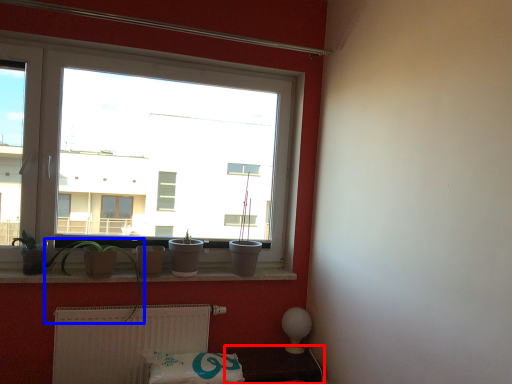
Question: Which of the following is the farthest to the observer, furniture (highlighted by a red box) or plant (highlighted by a blue box)?

Choices:
 (A) furniture
 (B) plant

Answer: (A)